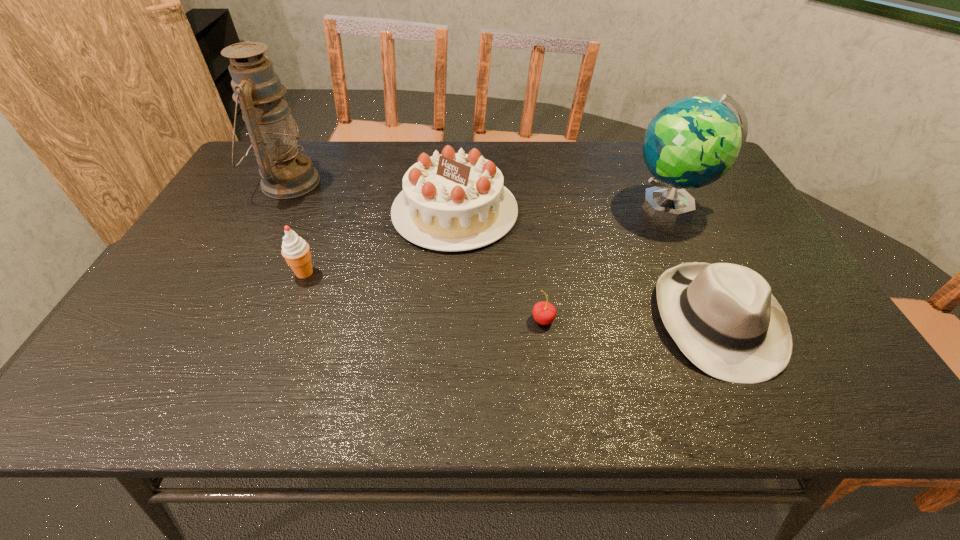
The height and width of the screenshot is (540, 960). Identify the location of free point between the icecream and the leftmost object. (296, 227).

Find the location of a particular element. unoccupied position between the birthday cake and the fedora is located at coordinates pyautogui.click(x=586, y=266).

Where is `vacant area between the fourth object from left to right and the globe`? The width and height of the screenshot is (960, 540). vacant area between the fourth object from left to right and the globe is located at coordinates (608, 262).

Locate an element on the screen. The width and height of the screenshot is (960, 540). free space between the fourth object from left to right and the fifth object from right to left is located at coordinates (424, 296).

The height and width of the screenshot is (540, 960). What are the coordinates of `free space between the fifth tallest object and the leftmost object` in the screenshot? It's located at (502, 252).

Find the location of a particular element. This screenshot has width=960, height=540. blank region between the fifth tallest object and the fourth object from right to left is located at coordinates (586, 266).

Locate an element on the screen. Image resolution: width=960 pixels, height=540 pixels. object that is the third nearest to the tallest object is located at coordinates (544, 313).

Locate which object ranks fifth in proximity to the tallest object. Please provide its 2D coordinates. Your answer should be formatted as a tuple, i.e. [(x, y)], where the tuple contains the x and y coordinates of a point satisfying the conditions above.

[(692, 142)]

The width and height of the screenshot is (960, 540). Identify the location of free location that satisfies the following two spatial constraints: 1. on the front side of the cherry; 2. on the right side of the tallest object. (215, 320).

Locate an element on the screen. The height and width of the screenshot is (540, 960). vacant position in the image that satisfies the following two spatial constraints: 1. on the front side of the oil lamp; 2. on the right side of the second object from left to right is located at coordinates (240, 273).